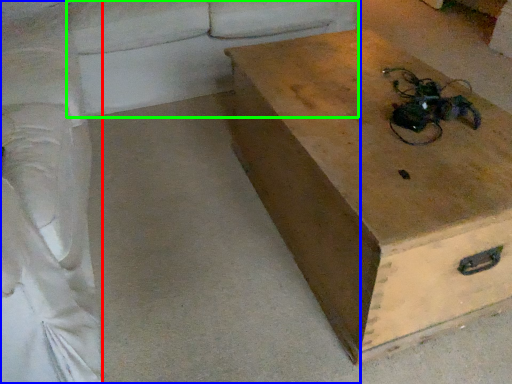
Question: Estimate the real-world distances between objects in this image. Which object is closer to couch (highlighted by a red box), studio couch (highlighted by a blue box) or couch (highlighted by a green box)?

Choices:
 (A) studio couch
 (B) couch

Answer: (A)